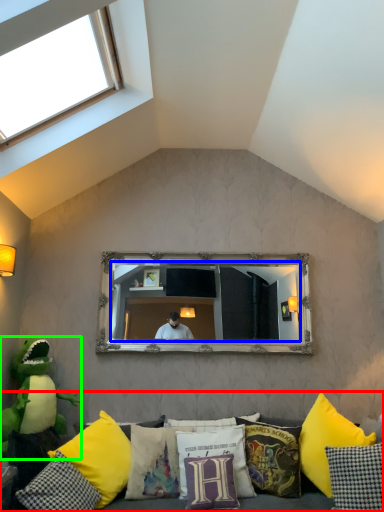
Question: Based on their relative distances, which object is nearer to studio couch (highlighted by a red box)? Choose from mirror (highlighted by a blue box) and toy (highlighted by a green box).

Choices:
 (A) mirror
 (B) toy

Answer: (B)